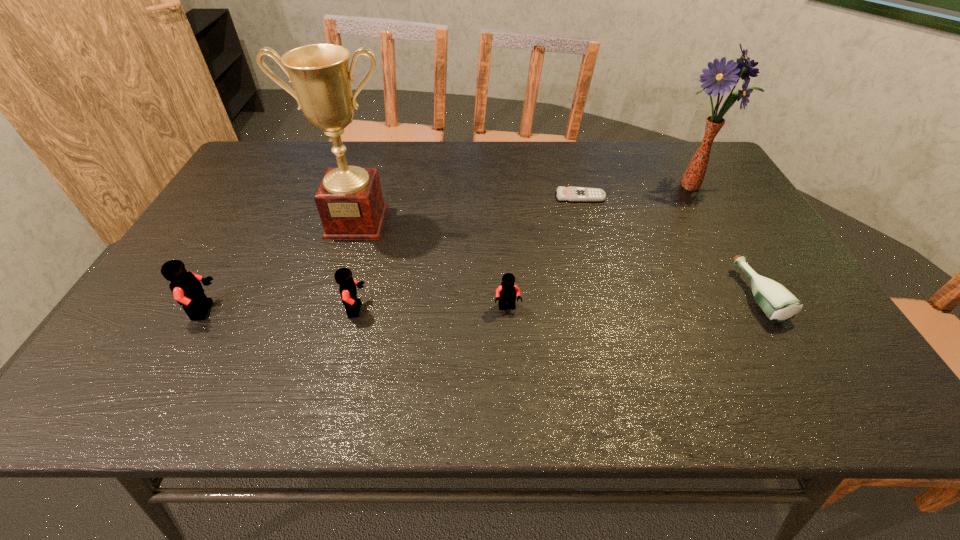
Image resolution: width=960 pixels, height=540 pixels. Find the location of `free space between the trophy cup and the bottle`. free space between the trophy cup and the bottle is located at coordinates (558, 258).

Locate an element on the screen. This screenshot has height=540, width=960. vacant area that lies between the fourth shortest object and the fifth nearest object is located at coordinates (357, 265).

Where is `free space that is in between the third tallest object and the trophy cup`? free space that is in between the third tallest object and the trophy cup is located at coordinates (281, 266).

This screenshot has height=540, width=960. Identify the location of free spot between the fourth tallest object and the shortest object. (468, 253).

In order to click on vacant space that is in between the sixth tallest object and the rightmost Lego in this screenshot , I will do `click(634, 301)`.

At what (x,y) coordinates should I click in order to perform the action: click on empty space between the bottle and the flower arrangement. Please return your answer as a coordinate pair (x, y). The width and height of the screenshot is (960, 540). Looking at the image, I should click on (726, 240).

The image size is (960, 540). Identify the location of free space between the second Lego from left to right and the remote control. (468, 253).

What are the coordinates of `unoccupied position between the shortest Lego and the flower arrangement` in the screenshot? It's located at (600, 246).

Find the location of a particular element. Image resolution: width=960 pixels, height=540 pixels. unoccupied position between the fourth tallest object and the rightmost Lego is located at coordinates (432, 308).

I want to click on object that is the second closest to the leftmost Lego, so click(x=343, y=276).